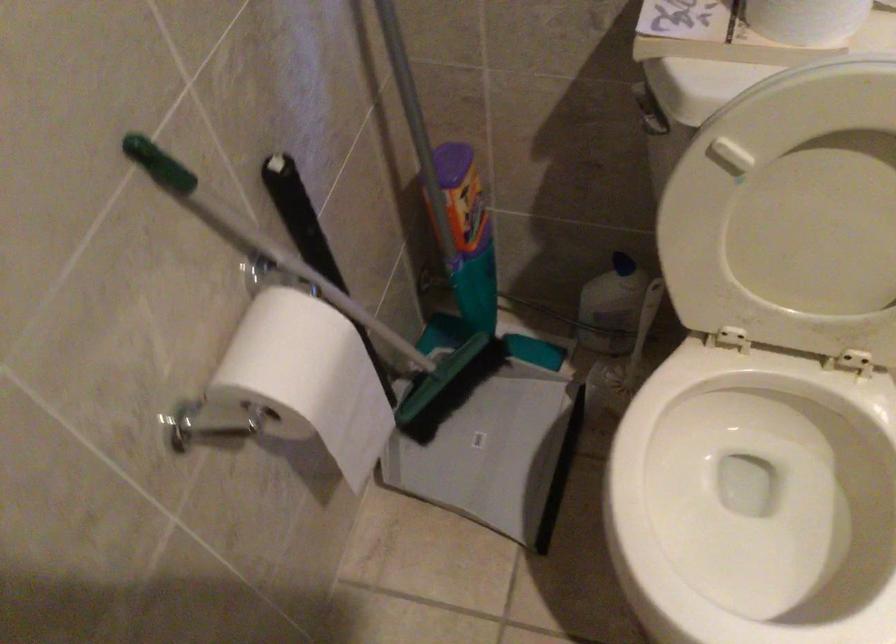
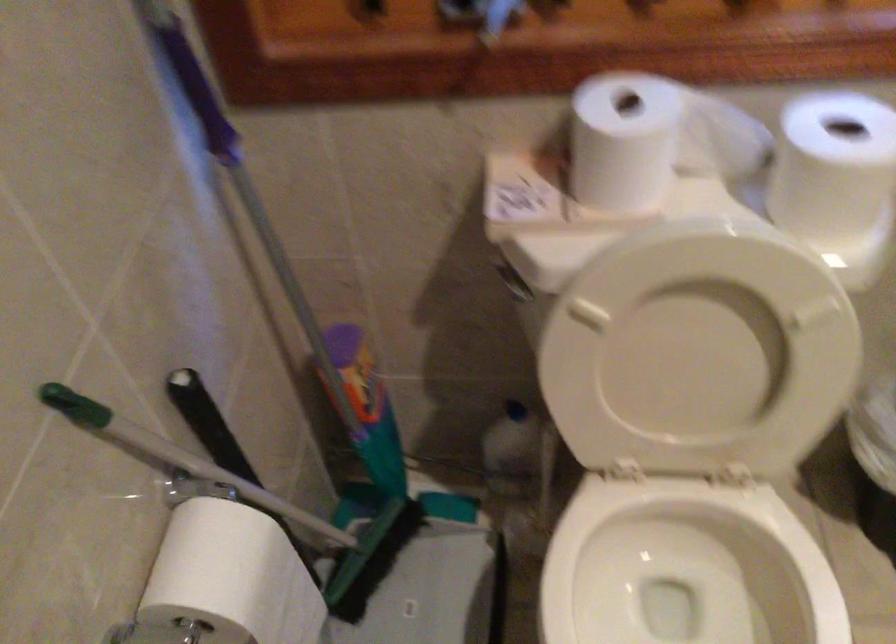
Question: The images are taken continuously from a first-person perspective. In which direction is your viewpoint rotating?

Choices:
 (A) Left
 (B) Right
 (C) Up
 (D) Down

Answer: (C)